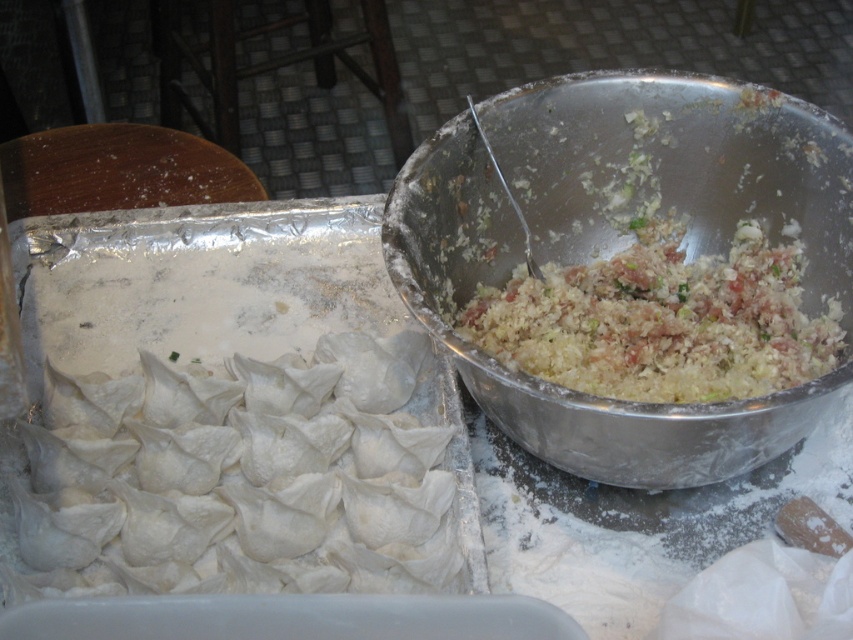
Between metallic silver bowl at center and white crumbly mixture at center, which one has less height?

white crumbly mixture at center

Can you confirm if metallic silver bowl at center is shorter than white crumbly mixture at center?

No.

Locate an element on the screen. This screenshot has width=853, height=640. metallic silver bowl at center is located at coordinates (624, 246).

In the scene shown: Is metallic silver bowl at center positioned in front of white doughy dumplings at left?

That is True.

Is metallic silver bowl at center taller than white doughy dumplings at left?

Yes.

Is point (844, 225) behind point (329, 518)?

Yes, it is.

Locate an element on the screen. Image resolution: width=853 pixels, height=640 pixels. metallic silver bowl at center is located at coordinates (624, 246).

The image size is (853, 640). What do you see at coordinates (241, 476) in the screenshot?
I see `white doughy dumplings at left` at bounding box center [241, 476].

Who is more forward, [74,516] or [665,388]?

Positioned in front is point [74,516].

Where is `white doughy dumplings at left`? The image size is (853, 640). white doughy dumplings at left is located at coordinates (241, 476).